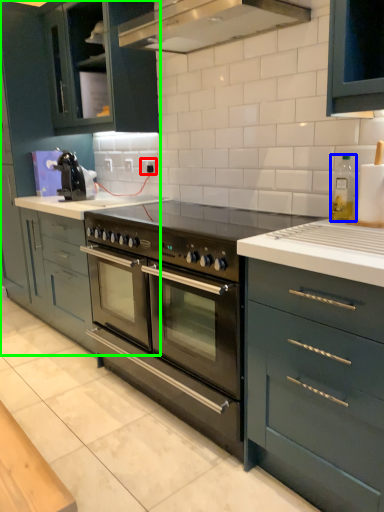
Question: Estimate the real-world distances between objects in this image. Which object is farther from electric outlet (highlighted by a red box), appliance (highlighted by a blue box) or cabinetry (highlighted by a green box)?

Choices:
 (A) appliance
 (B) cabinetry

Answer: (A)